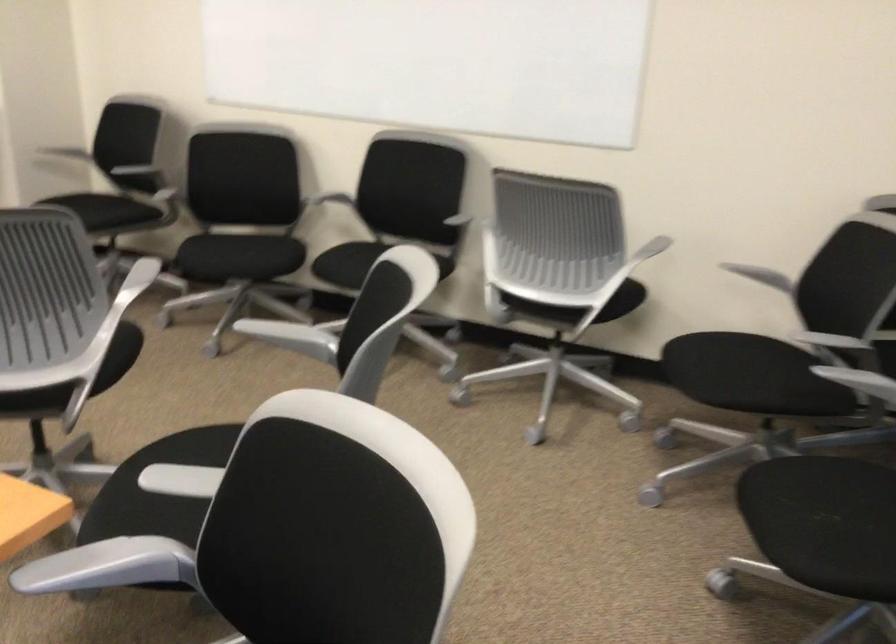
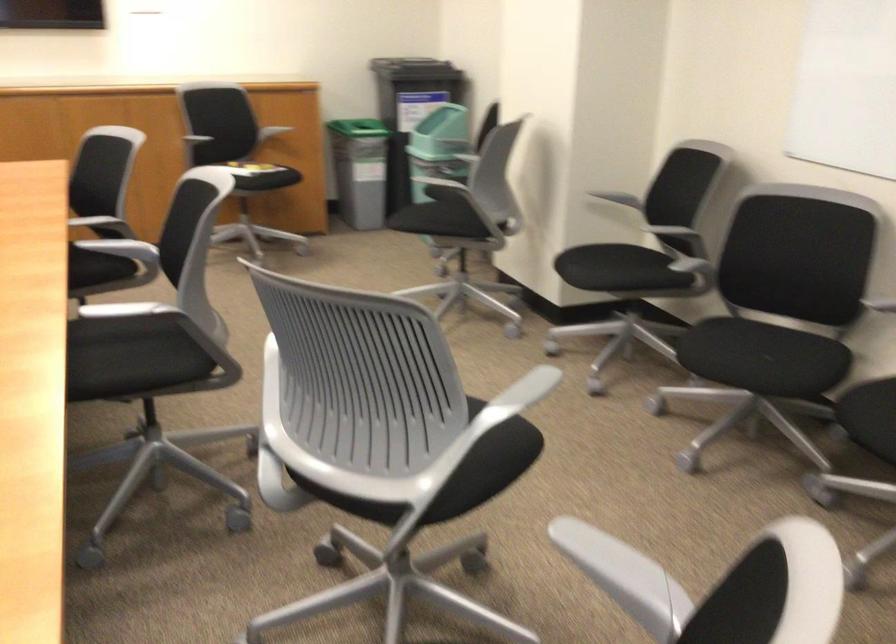
Question: The camera is either moving clockwise (left) or counter-clockwise (right) around the object. The first image is from the beginning of the video and the second image is from the end. Is the camera moving left or right when shooting the video?

Choices:
 (A) Left
 (B) Right

Answer: (B)